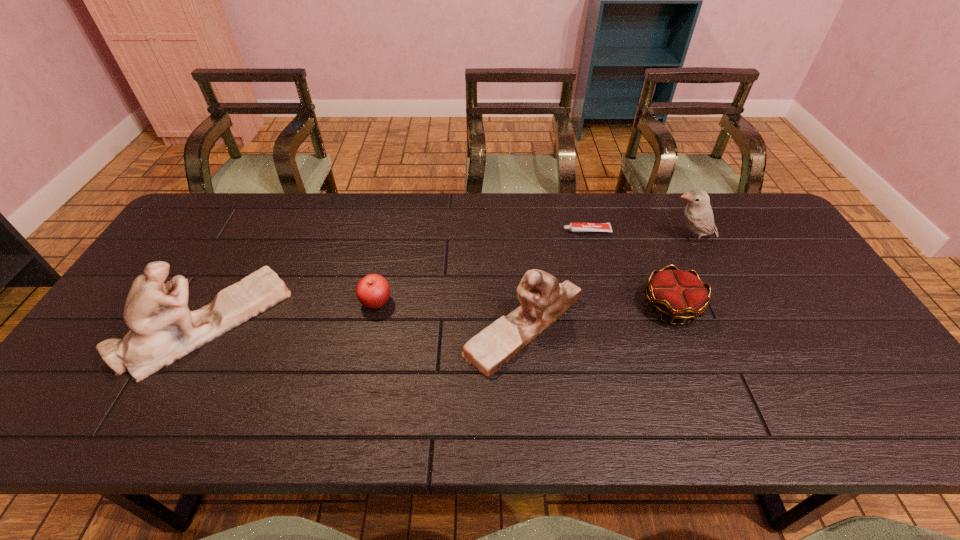
I want to click on bird positioned at the far edge, so click(x=698, y=214).

Locate an element on the screen. This screenshot has width=960, height=540. object present at the left edge is located at coordinates [162, 328].

Locate an element on the screen. object that is at the near left corner is located at coordinates (162, 328).

Locate an element on the screen. Image resolution: width=960 pixels, height=540 pixels. vacant space at the far edge of the desktop is located at coordinates (543, 237).

At what (x,y) coordinates should I click in order to perform the action: click on vacant space at the near edge. Please return your answer as a coordinate pair (x, y). This screenshot has width=960, height=540. Looking at the image, I should click on (559, 372).

Locate an element on the screen. The image size is (960, 540). free space at the left edge of the desktop is located at coordinates (218, 240).

In the image, there is a desktop. At what (x,y) coordinates should I click in order to perform the action: click on free space at the right edge. Please return your answer as a coordinate pair (x, y). The image size is (960, 540). Looking at the image, I should click on (833, 306).

Identify the location of free location at the far left corner. (222, 206).

Image resolution: width=960 pixels, height=540 pixels. Find the location of `free space at the far right corner of the desktop`. free space at the far right corner of the desktop is located at coordinates (752, 225).

Where is `unoccupied area between the bird and the left figurine`? Image resolution: width=960 pixels, height=540 pixels. unoccupied area between the bird and the left figurine is located at coordinates (448, 282).